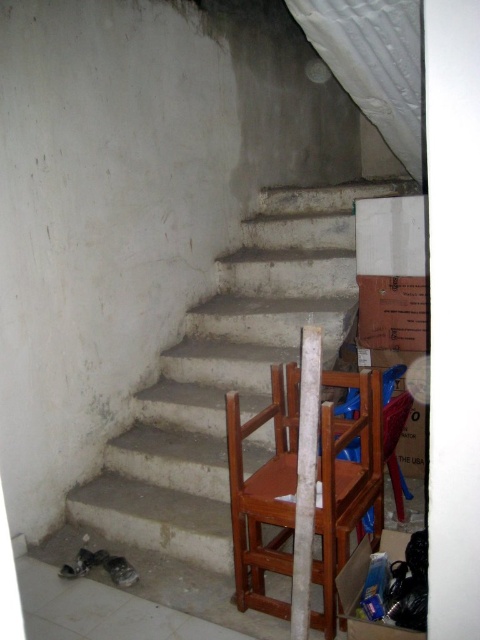
Question: Does white concrete stairs at center have a smaller size compared to brown wooden chair at right?

Choices:
 (A) no
 (B) yes

Answer: (A)

Question: In this image, where is white concrete stairs at center located relative to brown wooden chair at right?

Choices:
 (A) left
 (B) right

Answer: (A)

Question: Can you confirm if white concrete stairs at center is positioned to the right of brown wooden chair at right?

Choices:
 (A) yes
 (B) no

Answer: (B)

Question: Which point is farther to the camera?

Choices:
 (A) white concrete stairs at center
 (B) brown wooden chair at right

Answer: (A)